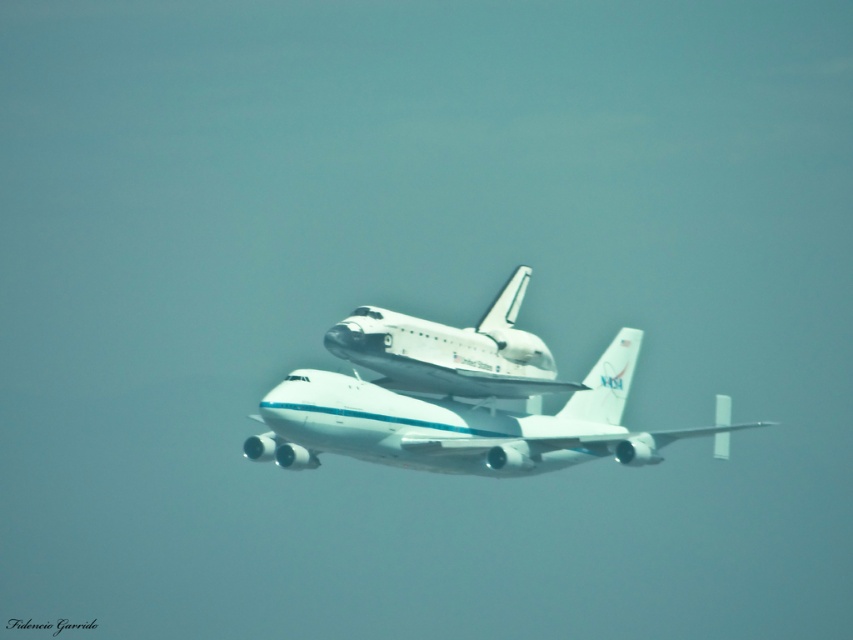
You are a NASA engineer responsible for ensuring safe distances between the white glossy airplane at center and the white glossy shuttle at center during transport. According to the specifications, the minimum safe distance between them must be at least 5 meters. Can you confirm if the current distance meets the safety requirements?

The white glossy airplane at center is 5.05 meters from the white glossy shuttle at center, which exceeds the minimum required distance of 5 meters. Therefore, the current distance meets the safety requirements.

You are a photographer trying to capture the NASA Space Shuttle mounted on the Shuttle Carrier Aircraft. You notice two points on the scene labeled as point 1 and point 2. If point 1 is at coordinate point (625, 460) and point 2 is at coordinate point (457, 353), which point is closer to your camera lens?

Point 1 at coordinate point (625, 460) is closer to the camera lens than point 2 at coordinate point (457, 353).